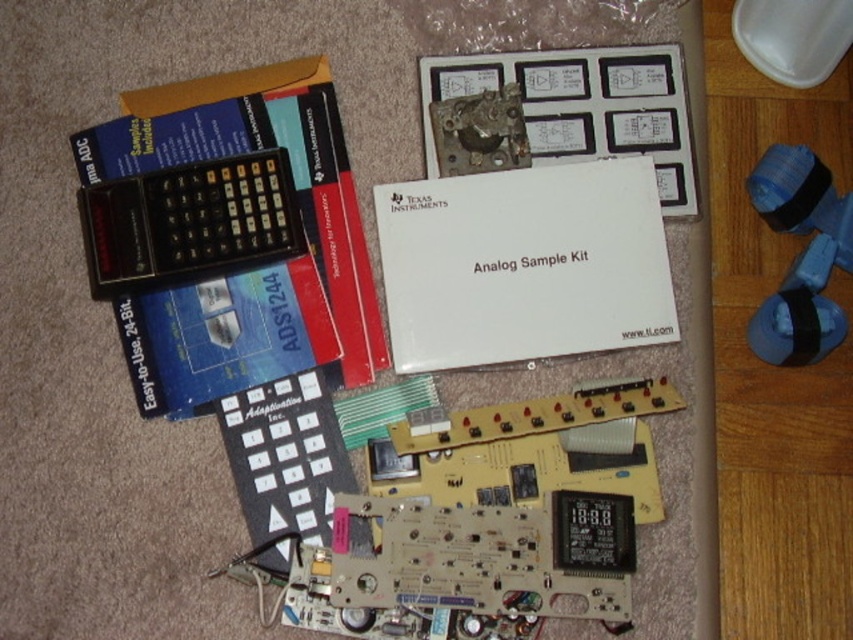
Looking at this image, can you confirm if metallic silver circuit board at upper center is taller than black plastic calculator at upper left?

Yes, metallic silver circuit board at upper center is taller than black plastic calculator at upper left.

Is point (554, 72) closer to camera compared to point (265, 202)?

No, (554, 72) is further to viewer.

Where is `metallic silver circuit board at upper center`? metallic silver circuit board at upper center is located at coordinates (582, 108).

Can you confirm if metallic silver circuit board at upper center is smaller than black plastic remote at center?

No, metallic silver circuit board at upper center is not smaller than black plastic remote at center.

Who is positioned more to the right, metallic silver circuit board at upper center or black plastic remote at center?

metallic silver circuit board at upper center is more to the right.

What do you see at coordinates (582, 108) in the screenshot? I see `metallic silver circuit board at upper center` at bounding box center [582, 108].

You are a GUI agent. You are given a task and a screenshot of the screen. Output one action in this format:
    pyautogui.click(x=<x>, y=<y>)
    Task: Click on the metallic silver circuit board at upper center
    The height and width of the screenshot is (640, 853).
    Given the screenshot: What is the action you would take?
    pyautogui.click(x=582, y=108)

Does point (201, 220) come closer to viewer compared to point (283, 556)?

No.

Who is lower down, black plastic calculator at upper left or black plastic remote at center?

black plastic remote at center

Who is more distant from viewer, (300, 248) or (326, 394)?

The point (300, 248) is behind.

Identify the location of black plastic calculator at upper left. (189, 221).